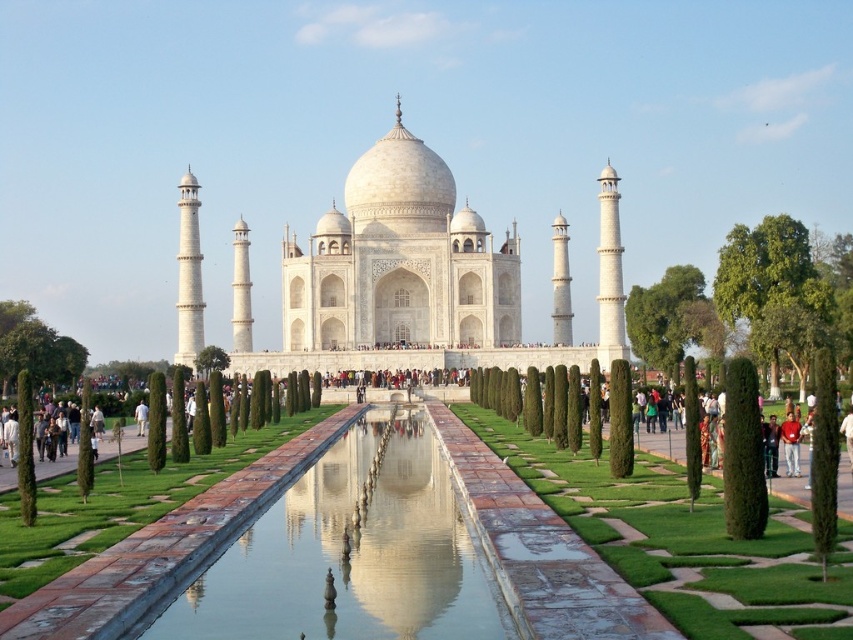
Does white marble taj mahal at center appear over green leafy tree at right?

Correct, white marble taj mahal at center is located above green leafy tree at right.

At what (x,y) coordinates should I click in order to perform the action: click on white marble taj mahal at center. Please return your answer as a coordinate pair (x, y). The height and width of the screenshot is (640, 853). Looking at the image, I should click on (418, 276).

Is point (434, 285) positioned in front of point (785, 216)?

That is False.

Locate an element on the screen. Image resolution: width=853 pixels, height=640 pixels. white marble taj mahal at center is located at coordinates (418, 276).

Is red cotton shirt at center bigger than green leafy tree at center?

Yes, red cotton shirt at center is bigger than green leafy tree at center.

Which is more to the right, red cotton shirt at center or green leafy tree at center?

Positioned to the right is red cotton shirt at center.

Identify the location of red cotton shirt at center. (790, 444).

Consider the image. Does green leafy tree at right appear on the left side of red cotton shirt at center?

Incorrect, green leafy tree at right is not on the left side of red cotton shirt at center.

This screenshot has height=640, width=853. What do you see at coordinates (775, 291) in the screenshot?
I see `green leafy tree at right` at bounding box center [775, 291].

Is point (782, 278) farther from camera compared to point (798, 433)?

That is True.

Where is `green leafy tree at right`? Image resolution: width=853 pixels, height=640 pixels. green leafy tree at right is located at coordinates (775, 291).